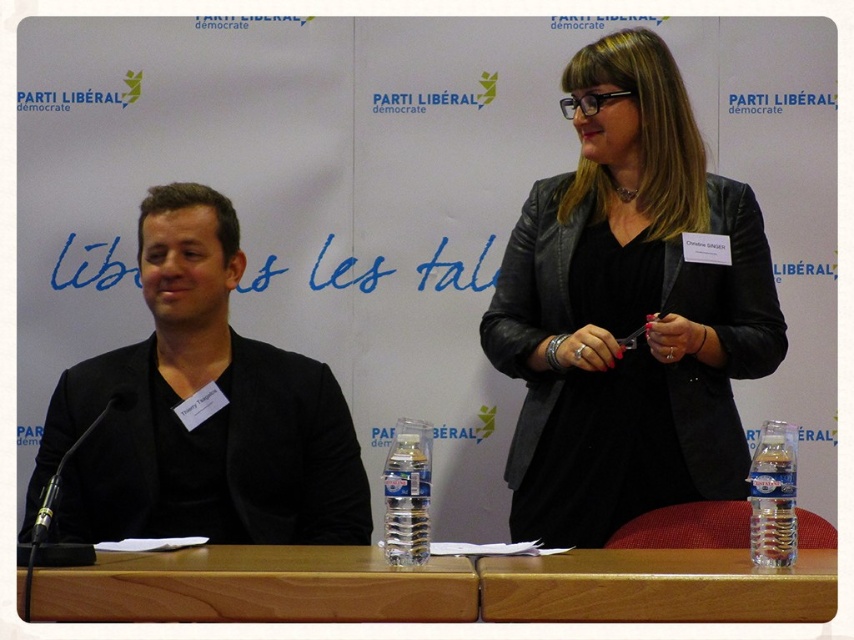
Measure the distance between wooden at lower center and camera.

wooden at lower center and camera are 4.33 feet apart from each other.

Which is behind, point (705, 605) or point (389, 458)?

The point (389, 458) is more distant.

Does point (679, 586) come behind point (420, 548)?

No.

Locate an element on the screen. wooden at lower center is located at coordinates (654, 588).

Is point (431, 580) farther from viewer compared to point (393, 528)?

No, (431, 580) is closer to viewer.

Can you confirm if wooden table at center is positioned above clear plastic bottle at center?

Actually, wooden table at center is below clear plastic bottle at center.

Locate an element on the screen. This screenshot has width=854, height=640. wooden table at center is located at coordinates (256, 588).

The image size is (854, 640). I want to click on wooden table at center, so click(256, 588).

Does black leather jacket at upper right have a smaller size compared to clear plastic bottle at lower right?

Actually, black leather jacket at upper right might be larger than clear plastic bottle at lower right.

Does point (542, 385) lie in front of point (794, 440)?

No.

At what (x,y) coordinates should I click in order to perform the action: click on black leather jacket at upper right. Please return your answer as a coordinate pair (x, y). This screenshot has height=640, width=854. Looking at the image, I should click on (629, 308).